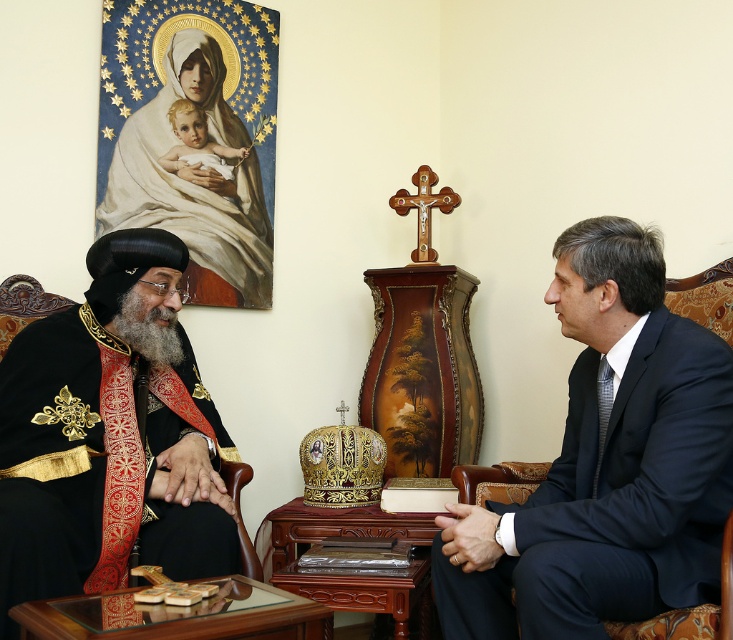
Question: Can you confirm if dark blue suit at right is positioned to the left of black velvet robe at left?

Choices:
 (A) no
 (B) yes

Answer: (A)

Question: Among these points, which one is nearest to the camera?

Choices:
 (A) (567, 324)
 (B) (1, 385)

Answer: (A)

Question: Which point is farther to the camera?

Choices:
 (A) dark blue suit at right
 (B) black velvet robe at left

Answer: (B)

Question: Is dark blue suit at right further to the viewer compared to black velvet robe at left?

Choices:
 (A) yes
 (B) no

Answer: (B)

Question: Can you confirm if dark blue suit at right is positioned to the right of black velvet robe at left?

Choices:
 (A) no
 (B) yes

Answer: (B)